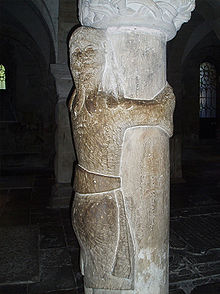
Locate an element on the screen. gated window in distance is located at coordinates (204, 90).